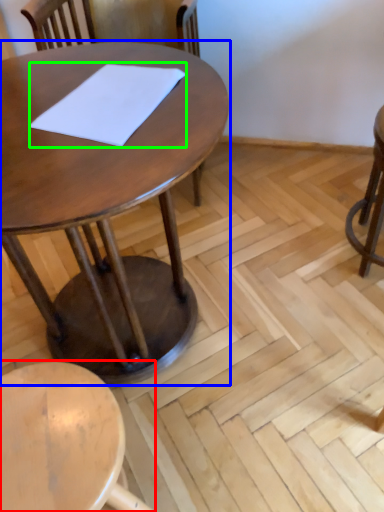
Question: Considering the real-world distances, which object is farthest from stool (highlighted by a red box)? table (highlighted by a blue box) or notepad (highlighted by a green box)?

Choices:
 (A) table
 (B) notepad

Answer: (B)